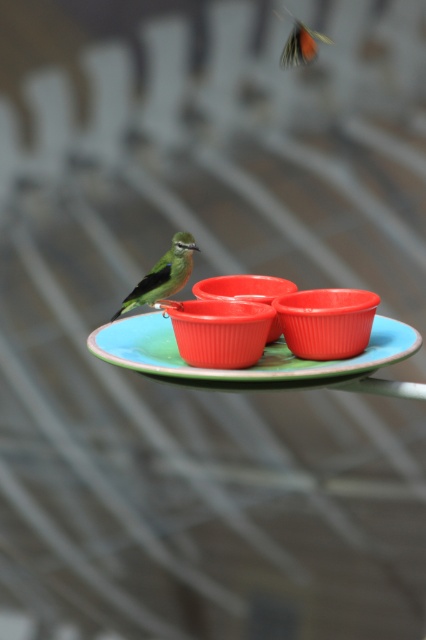
Question: Is matte plastic plate at center above green matte bird at center?

Choices:
 (A) no
 (B) yes

Answer: (A)

Question: Can you confirm if matte plastic plate at center is thinner than green matte bird at center?

Choices:
 (A) no
 (B) yes

Answer: (A)

Question: Which of the following is the closest to the observer?

Choices:
 (A) green matte bird at center
 (B) matte plastic plate at center

Answer: (B)

Question: Can you confirm if matte plastic plate at center is positioned to the left of green matte bird at center?

Choices:
 (A) no
 (B) yes

Answer: (A)